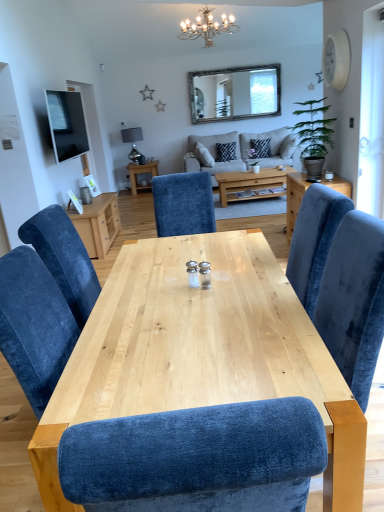
Locate an element on the screen. free space above natural wood table at center, the 3th table positioned from the top (from a real-world perspective) is located at coordinates (193, 309).